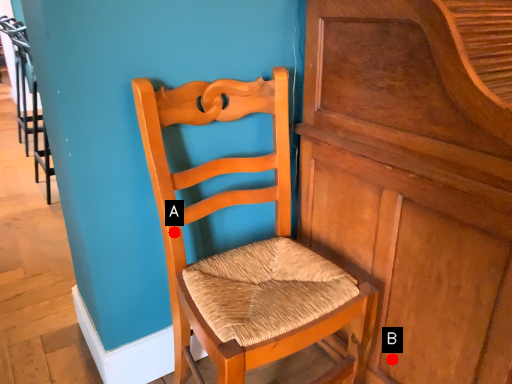
Question: Two points are circled on the image, labeled by A and B beside each circle. Which point is closer to the camera?

Choices:
 (A) A is closer
 (B) B is closer

Answer: (A)